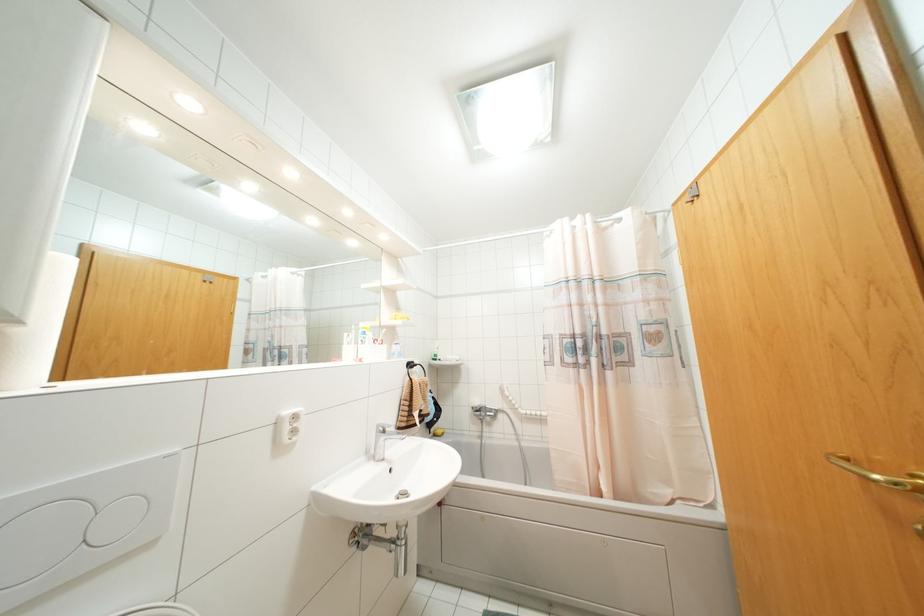
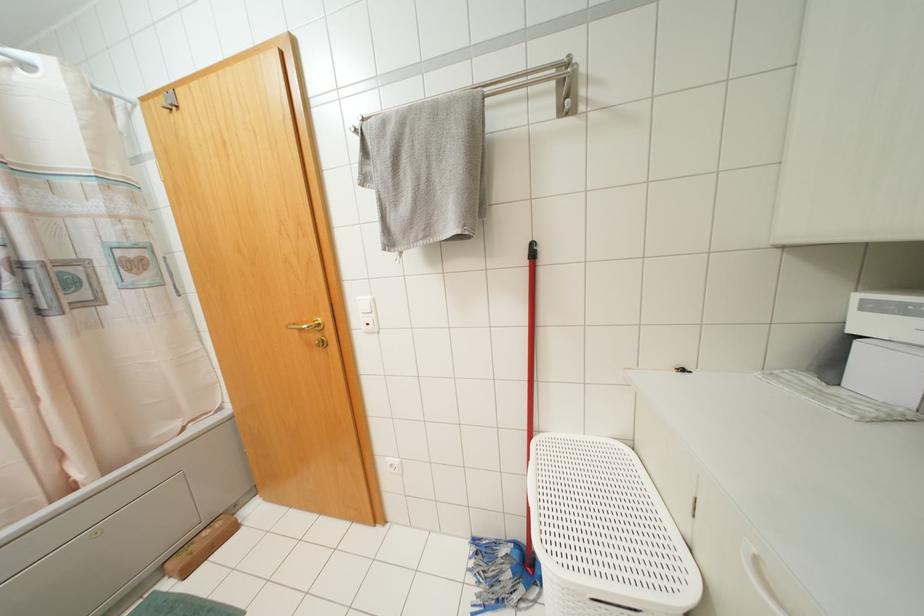
Question: Based on the continuous images, in which direction is the camera rotating? Reply with the corresponding letter.

Choices:
 (A) Left
 (B) Right
 (C) Up
 (D) Down

Answer: (B)